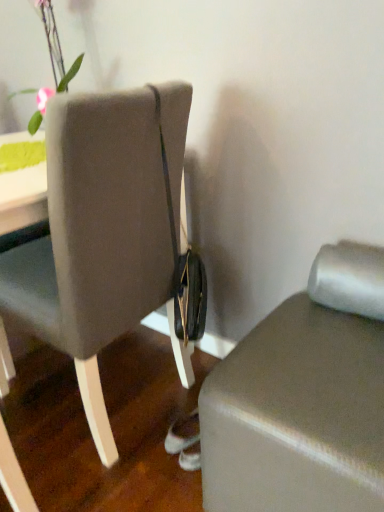
Describe the element at coordinates (104, 232) in the screenshot. The width and height of the screenshot is (384, 512). I see `matte gray chair at center` at that location.

Measure the distance between green matte vase at upper left and camera.

A distance of 1.34 meters exists between green matte vase at upper left and camera.

The image size is (384, 512). I want to click on green matte vase at upper left, so click(x=56, y=47).

Locate an element on the screen. The height and width of the screenshot is (512, 384). matte gray chair at center is located at coordinates (104, 232).

Are matte gray ottoman at lower right and matte gray chair at center beside each other?

No, matte gray ottoman at lower right is not beside matte gray chair at center.

Between matte gray ottoman at lower right and matte gray chair at center, which one has larger width?

matte gray chair at center is wider.

From the image's perspective, does matte gray ottoman at lower right appear higher than matte gray chair at center?

No, from the image's perspective, matte gray ottoman at lower right is not above matte gray chair at center.

Consider the image. Considering the positions of objects matte gray ottoman at lower right and matte gray chair at center in the image provided, who is in front, matte gray ottoman at lower right or matte gray chair at center?

matte gray ottoman at lower right.

How different are the orientations of matte gray ottoman at lower right and green matte vase at upper left in degrees?

The angle between the facing direction of matte gray ottoman at lower right and the facing direction of green matte vase at upper left is 0.000401 degrees.

Image resolution: width=384 pixels, height=512 pixels. In order to click on furniture that is under the green matte vase at upper left (from a real-world perspective) in this screenshot , I will do `click(303, 398)`.

Looking at this image, between matte gray ottoman at lower right and green matte vase at upper left, which one has smaller size?

green matte vase at upper left.

From the picture: Is matte gray ottoman at lower right in front of or behind green matte vase at upper left in the image?

In the image, matte gray ottoman at lower right appears in front of green matte vase at upper left.

Is matte gray chair at center aimed at matte gray ottoman at lower right?

No, matte gray chair at center is not aimed at matte gray ottoman at lower right.

From the picture: Between matte gray chair at center and matte gray ottoman at lower right, which one has larger width?

With larger width is matte gray chair at center.

Is point (121, 189) closer to viewer compared to point (363, 470)?

No, (121, 189) is further to viewer.

Considering the points (86, 324) and (43, 17), which point is behind, point (86, 324) or point (43, 17)?

Positioned behind is point (43, 17).

Identify the location of floral arrangement on the left of matte gray chair at center. (56, 47).

In the image, is matte gray chair at center positioned in front of or behind green matte vase at upper left?

matte gray chair at center is in front of green matte vase at upper left.

From a real-world perspective, is matte gray chair at center positioned above or below green matte vase at upper left?

Clearly, from a real-world perspective, matte gray chair at center is below green matte vase at upper left.

Does point (56, 74) appear closer or farther from the camera than point (65, 121)?

Point (56, 74).

Would you say green matte vase at upper left is a long distance from matte gray chair at center?

No, green matte vase at upper left is not far from matte gray chair at center.

Does green matte vase at upper left turn towards matte gray chair at center?

No, green matte vase at upper left is not facing towards matte gray chair at center.

Consider the image. How many degrees apart are the facing directions of green matte vase at upper left and matte gray chair at center?

green matte vase at upper left and matte gray chair at center are facing 90 degrees away from each other.

Considering the sizes of objects green matte vase at upper left and matte gray ottoman at lower right in the image provided, who is wider, green matte vase at upper left or matte gray ottoman at lower right?

matte gray ottoman at lower right is wider.

From the picture: Does green matte vase at upper left touch matte gray ottoman at lower right?

There is a gap between green matte vase at upper left and matte gray ottoman at lower right.

Is green matte vase at upper left turned away from matte gray ottoman at lower right?

No, green matte vase at upper left's orientation is not away from matte gray ottoman at lower right.

In order to click on furniture in front of the matte gray chair at center in this screenshot , I will do `click(303, 398)`.

Where is `floral arrangement on the left of matte gray ottoman at lower right`? floral arrangement on the left of matte gray ottoman at lower right is located at coordinates [x=56, y=47].

Estimate the real-world distances between objects in this image. Which object is closer to matte gray chair at center, matte gray ottoman at lower right or green matte vase at upper left?

matte gray ottoman at lower right.

Looking at the image, which one is located further to green matte vase at upper left, matte gray chair at center or matte gray ottoman at lower right?

Among the two, matte gray ottoman at lower right is located further to green matte vase at upper left.

Which object lies nearer to the anchor point green matte vase at upper left, matte gray ottoman at lower right or matte gray chair at center?

matte gray chair at center is closer to green matte vase at upper left.

Based on their spatial positions, is green matte vase at upper left or matte gray ottoman at lower right closer to matte gray chair at center?

matte gray ottoman at lower right is closer to matte gray chair at center.

Based on their spatial positions, is matte gray chair at center or green matte vase at upper left closer to matte gray ottoman at lower right?

matte gray chair at center lies closer to matte gray ottoman at lower right than the other object.

Which object lies further to the anchor point matte gray ottoman at lower right, green matte vase at upper left or matte gray chair at center?

green matte vase at upper left.

At what (x,y) coordinates should I click in order to perform the action: click on chair between green matte vase at upper left and matte gray ottoman at lower right in the up-down direction. Please return your answer as a coordinate pair (x, y). The image size is (384, 512). Looking at the image, I should click on (104, 232).